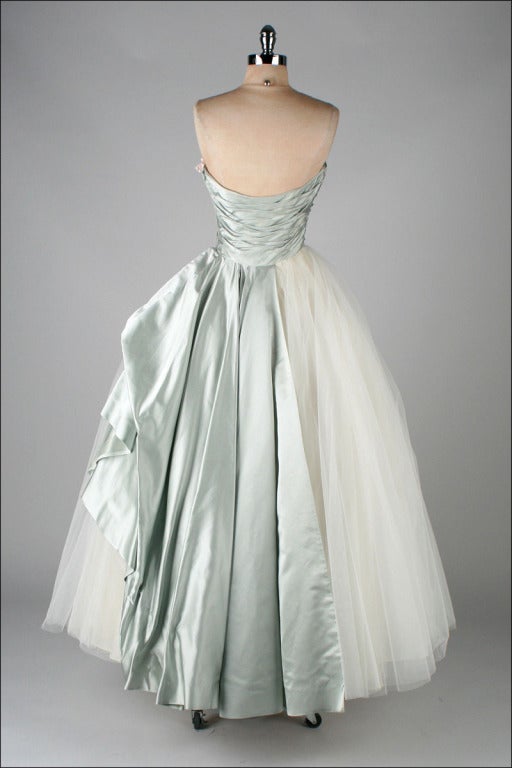
Find the location of a particular element. rods metal silver is located at coordinates (269, 47).